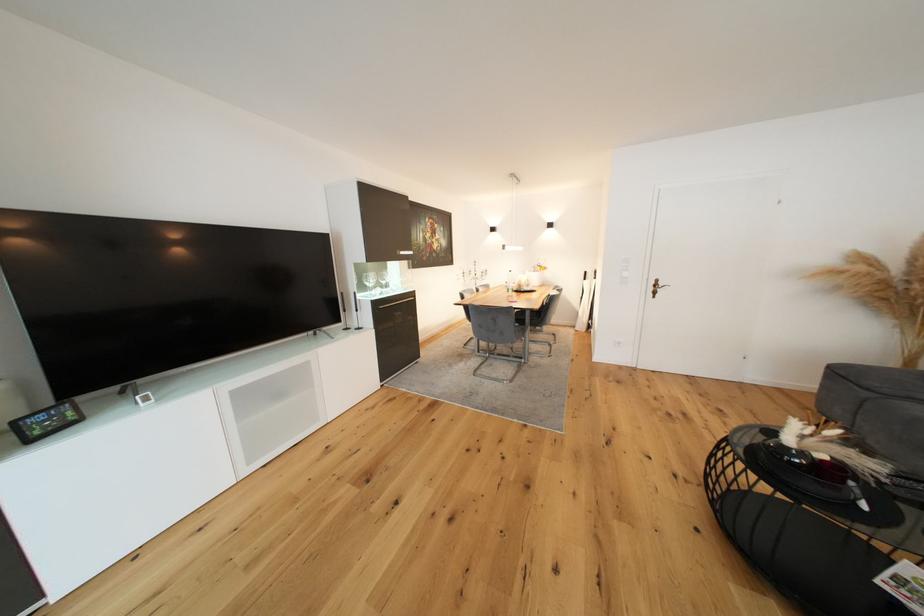
What do you see at coordinates (893, 432) in the screenshot?
I see `a sofa sitting surface` at bounding box center [893, 432].